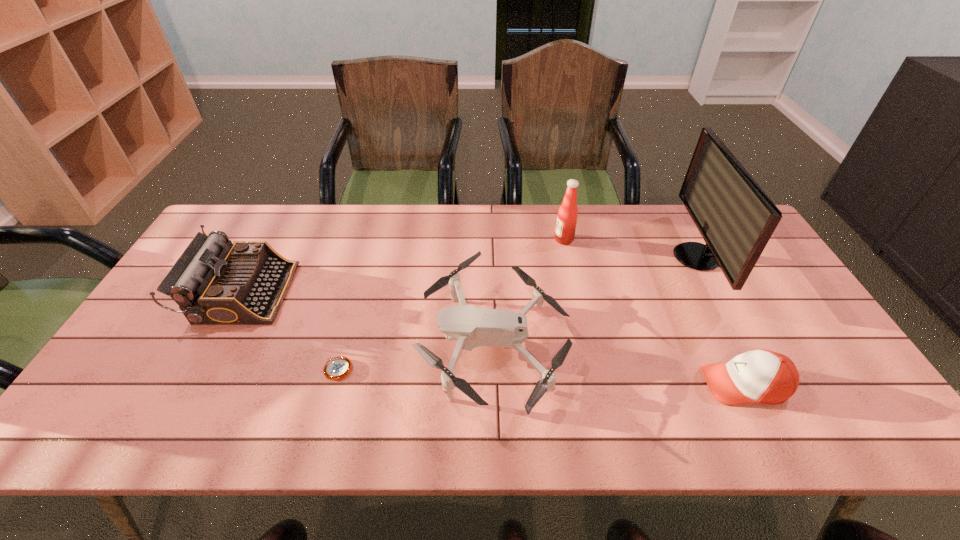
The height and width of the screenshot is (540, 960). Find the location of `object located at the far right corner`. object located at the far right corner is located at coordinates (735, 217).

Find the location of `object present at the near right corner`. object present at the near right corner is located at coordinates (763, 376).

Identify the location of blank area at the far edge. Image resolution: width=960 pixels, height=540 pixels. (385, 206).

At what (x,y) coordinates should I click in order to perform the action: click on free location at the near edge of the desktop. Please return your answer as a coordinate pair (x, y). Image resolution: width=960 pixels, height=540 pixels. Looking at the image, I should click on (515, 428).

Image resolution: width=960 pixels, height=540 pixels. What are the coordinates of `free space at the right edge` in the screenshot? It's located at (758, 310).

Locate an element on the screen. Image resolution: width=960 pixels, height=540 pixels. free space at the near right corner of the desktop is located at coordinates (839, 416).

In order to click on free space between the shortest object and the fourth shortest object in this screenshot , I will do `click(291, 331)`.

You are a GUI agent. You are given a task and a screenshot of the screen. Output one action in this format:
    pyautogui.click(x=<x>, y=<y>)
    Task: Click on the vacant region between the third object from left to right and the typewriter
    
    Given the screenshot: What is the action you would take?
    pyautogui.click(x=369, y=318)

Locate an element on the screen. The width and height of the screenshot is (960, 540). free space between the leftmost object and the second tallest object is located at coordinates (403, 266).

Locate an element on the screen. The width and height of the screenshot is (960, 540). vacant region between the leftmost object and the fifth object from right to left is located at coordinates (291, 331).